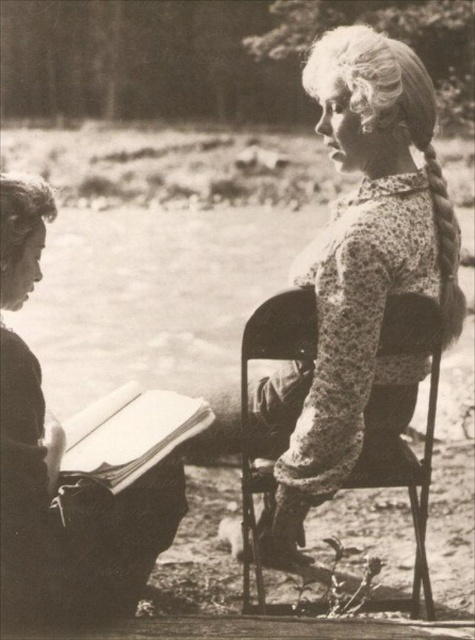
From the picture: You are organizing a library and need to place the smooth paper book at left and the metallic black chair at center on a shelf. The shelf has a width of 1 meter. Can both items fit side by side on the shelf without overlapping?

The smooth paper book at left has a smaller width than the metallic black chair at center. However, since the total width of both items combined is unknown, we cannot determine if they will fit on the 1 meter shelf without overlapping. More information about their individual dimensions is needed.